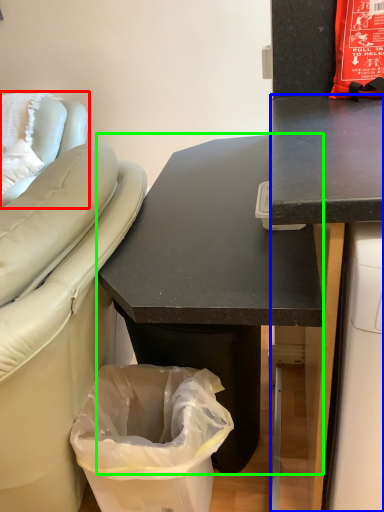
Question: Based on their relative distances, which object is farther from furniture (highlighted by a red box)? Choose from desk (highlighted by a blue box) and desk (highlighted by a green box).

Choices:
 (A) desk
 (B) desk

Answer: (A)